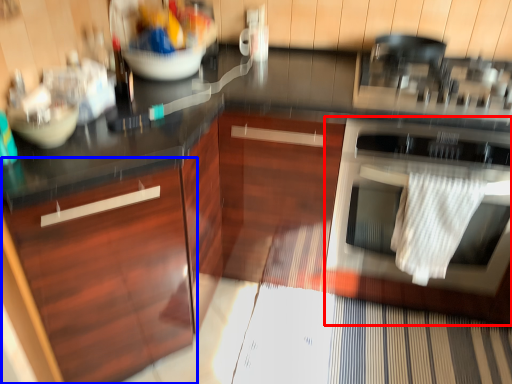
Question: Which point is further to the camera, home appliance (highlighted by a red box) or cabinetry (highlighted by a blue box)?

Choices:
 (A) home appliance
 (B) cabinetry

Answer: (A)